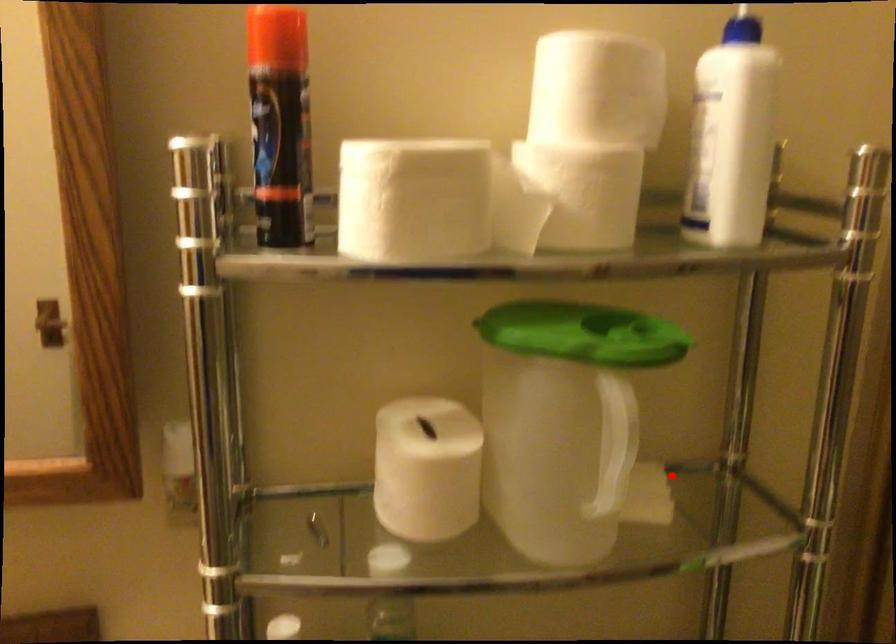
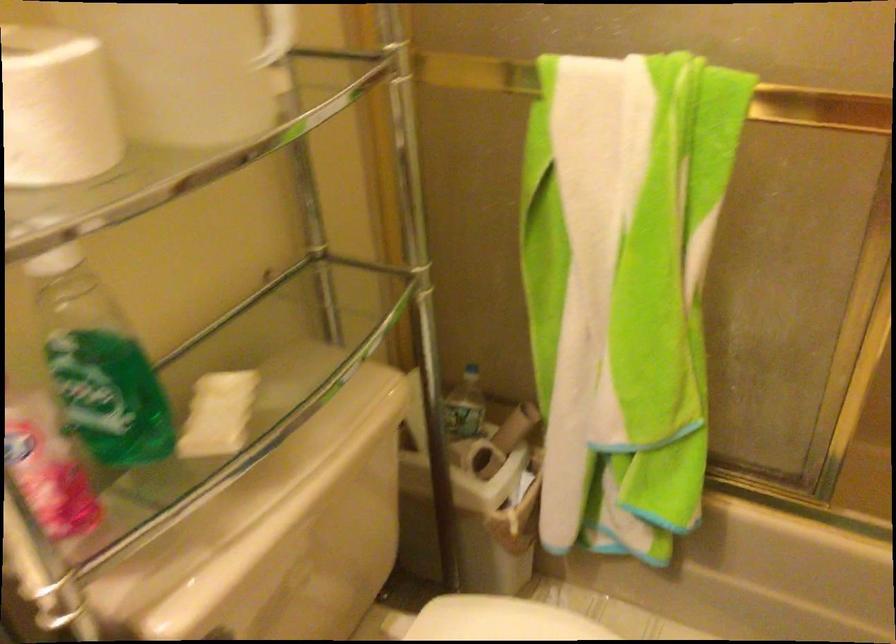
Question: A red point is marked in image1. In image2, is the corresponding 3D point closer to the camera or farther? Reply with the corresponding letter.

Choices:
 (A) The corresponding 3D point is closer.
 (B) The corresponding 3D point is farther.

Answer: (A)